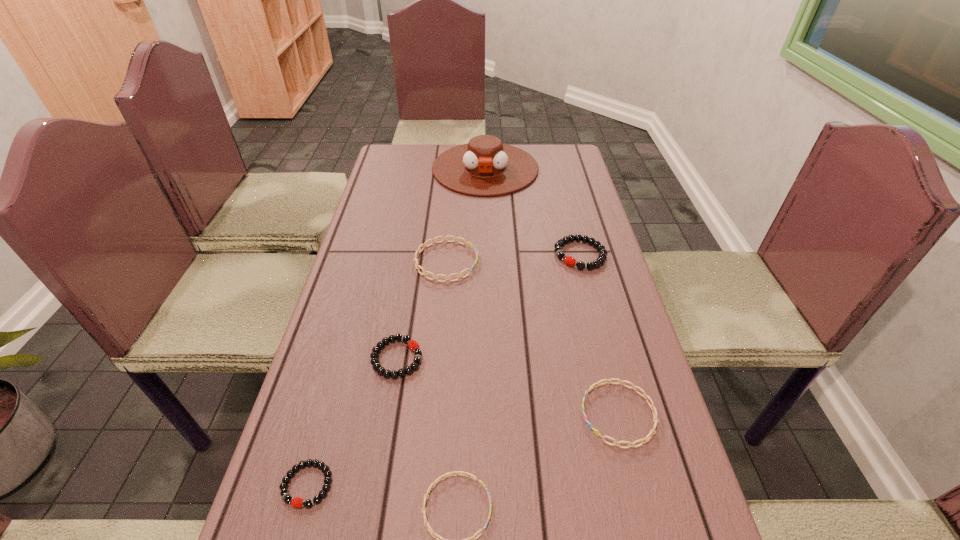
The image size is (960, 540). Identify the location of object that is the sixth closest to the farthest black bracelet. (308, 503).

I want to click on bracelet that stands as the third closest to the smallest black bracelet, so click(x=644, y=440).

Choose which bracelet is the third nearest neighbor to the leftmost object. Please provide its 2D coordinates. Your answer should be formatted as a tuple, i.e. [(x, y)], where the tuple contains the x and y coordinates of a point satisfying the conditions above.

[(644, 440)]

Where is `blue bracelet that stands as the second closest to the rightmost black bracelet`? The image size is (960, 540). blue bracelet that stands as the second closest to the rightmost black bracelet is located at coordinates (644, 440).

Identify which blue bracelet is the nearest to the second nearest black bracelet. Please provide its 2D coordinates. Your answer should be formatted as a tuple, i.e. [(x, y)], where the tuple contains the x and y coordinates of a point satisfying the conditions above.

[(424, 245)]

The image size is (960, 540). I want to click on black bracelet that is the closest to the cowboy hat, so click(568, 260).

You are a GUI agent. You are given a task and a screenshot of the screen. Output one action in this format:
    pyautogui.click(x=<x>, y=<y>)
    Task: Click on the black bracelet object that ranks as the closest to the second biggest black bracelet
    Image resolution: width=960 pixels, height=540 pixels.
    Given the screenshot: What is the action you would take?
    pyautogui.click(x=308, y=503)